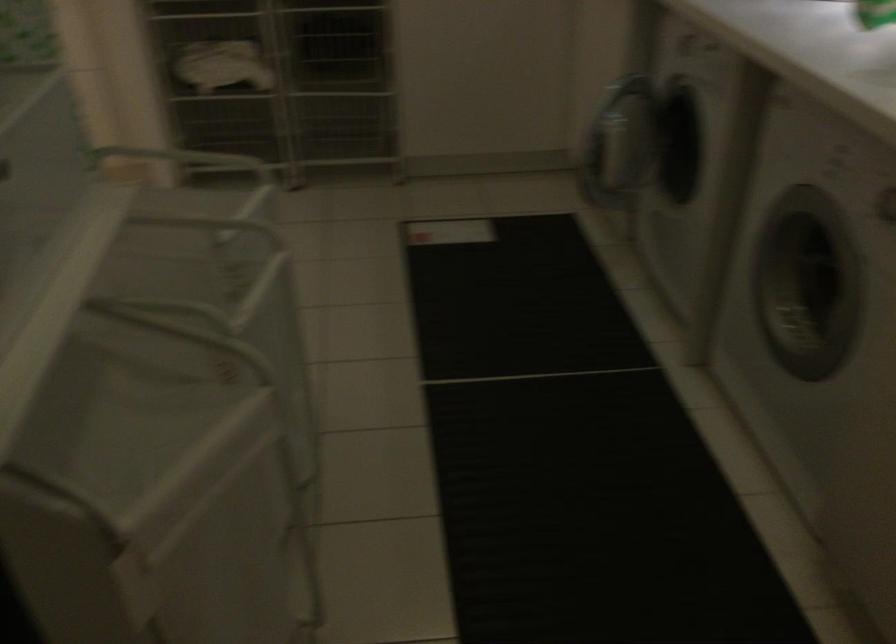
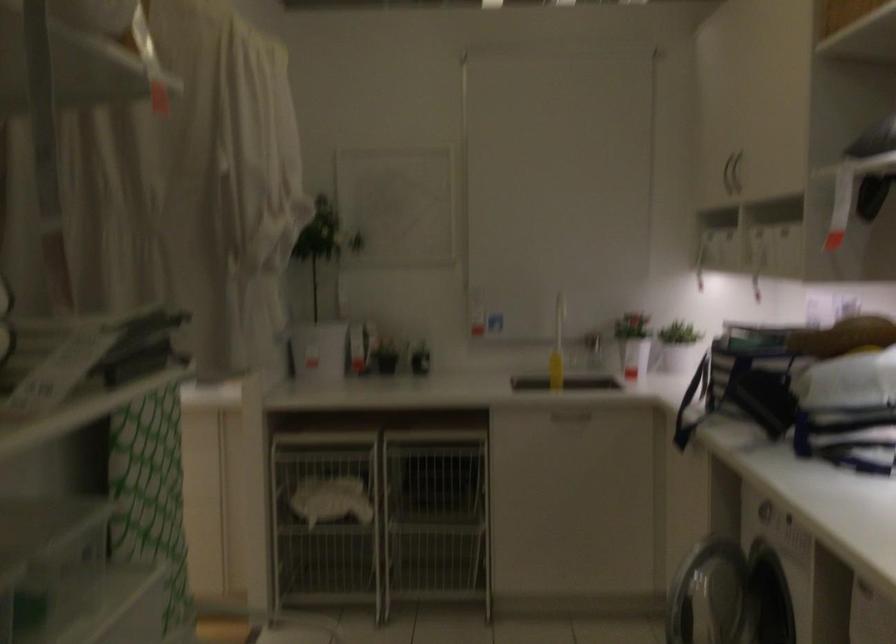
The first image is from the beginning of the video and the second image is from the end. How did the camera likely rotate when shooting the video?

The rotation direction of the camera is right-down.